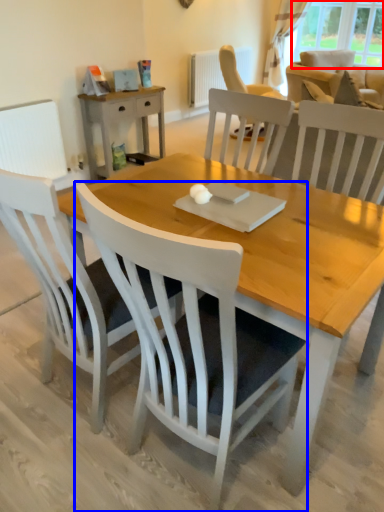
Question: Among these objects, which one is nearest to the camera, window (highlighted by a red box) or chair (highlighted by a blue box)?

Choices:
 (A) window
 (B) chair

Answer: (B)